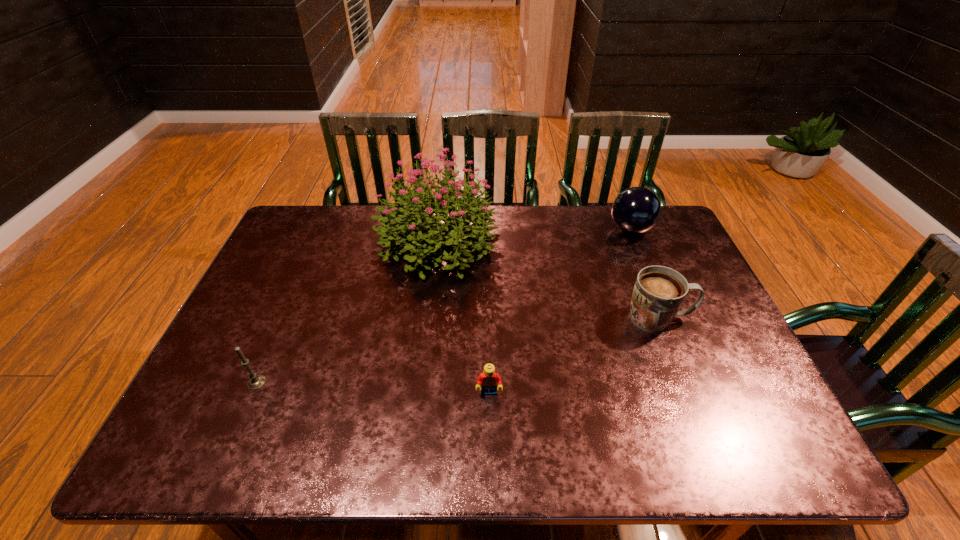
Find the location of a particular element. the tallest object is located at coordinates (422, 207).

At what (x,y) coordinates should I click in order to perform the action: click on bowling ball. Please return your answer as a coordinate pair (x, y). This screenshot has height=540, width=960. Looking at the image, I should click on (636, 210).

Identify the location of mug. The width and height of the screenshot is (960, 540). (659, 292).

Image resolution: width=960 pixels, height=540 pixels. In order to click on candle in this screenshot , I will do `click(257, 381)`.

Find the location of `the shortest object`. the shortest object is located at coordinates tap(488, 379).

What are the coordinates of `vacant space located on the front of the tallest object` in the screenshot? It's located at (424, 347).

You are a GUI agent. You are given a task and a screenshot of the screen. Output one action in this format:
    pyautogui.click(x=<x>, y=<y>)
    Task: Click on the free space located 0.120m on the side of the bowling ball with the finger holes
    
    Given the screenshot: What is the action you would take?
    pyautogui.click(x=572, y=230)

Image resolution: width=960 pixels, height=540 pixels. Identify the location of free space located on the side of the bowling ball with the finger holes. (572, 230).

The height and width of the screenshot is (540, 960). Find the location of `vacant space located 0.150m on the side of the bowling ball with the finger holes`. vacant space located 0.150m on the side of the bowling ball with the finger holes is located at coordinates (564, 230).

Identify the location of vacant space positioned 0.070m on the left of the candle. (219, 383).